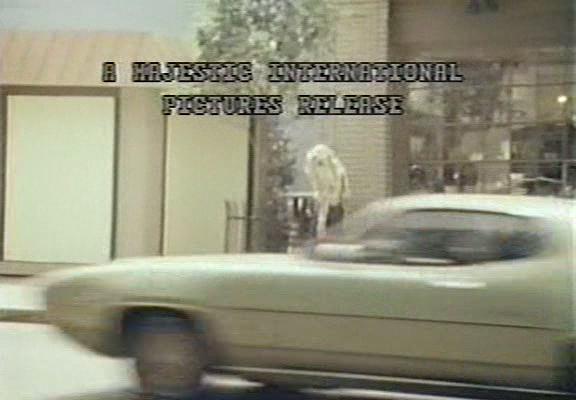
At what (x,y) coordinates should I click in order to perform the action: click on handle. Please return your answer as a coordinate pair (x, y). This screenshot has height=400, width=576. Looking at the image, I should click on (454, 297).